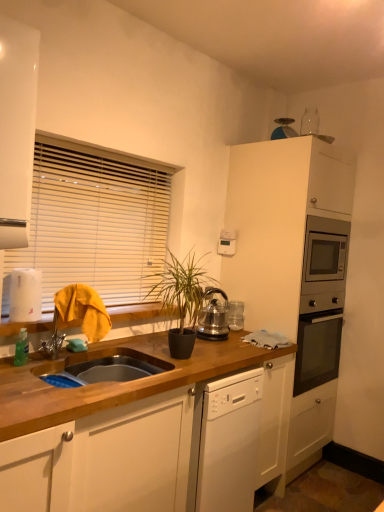
Question: Considering the relative positions of wooden at left and white glossy cabinet at upper left, arranged as the first cabinetry when viewed from the left, in the image provided, is wooden at left to the left or to the right of white glossy cabinet at upper left, arranged as the first cabinetry when viewed from the left,?

Choices:
 (A) right
 (B) left

Answer: (A)

Question: Is wooden at left inside the boundaries of white glossy cabinet at upper left, placed as the second cabinetry when sorted from right to left, or outside?

Choices:
 (A) outside
 (B) inside

Answer: (A)

Question: Which object is positioned farthest from the polished stainless steel kettle at center?

Choices:
 (A) wooden blinds at upper left
 (B) wooden at left
 (C) white matte cabinet at upper right, the 1th cabinetry viewed from the back
 (D) white glossy cabinet at upper left, placed as the second cabinetry when sorted from right to left
 (E) green matte plant at center

Answer: (D)

Question: Which of these objects is positioned closest to the polished stainless steel kettle at center?

Choices:
 (A) white glossy cabinet at upper left, marked as the first cabinetry in a front-to-back arrangement
 (B) white matte cabinet at upper right, which is the 2th cabinetry in left-to-right order
 (C) green matte plant at center
 (D) wooden blinds at upper left
 (E) wooden at left

Answer: (C)